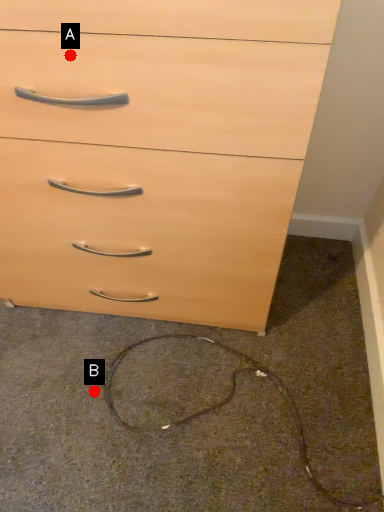
Question: Two points are circled on the image, labeled by A and B beside each circle. Which point is closer to the camera?

Choices:
 (A) A is closer
 (B) B is closer

Answer: (A)